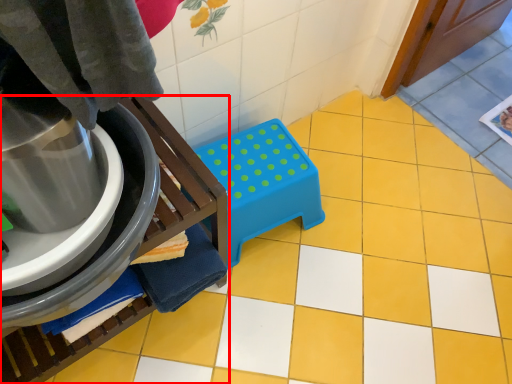
Question: Where is furniture (annotated by the red box) located in relation to step stool in the image?

Choices:
 (A) right
 (B) left

Answer: (B)